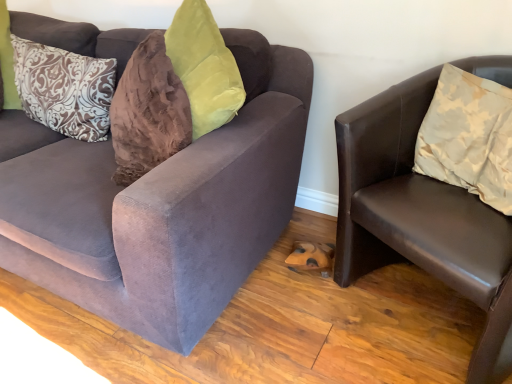
Locate an element on the screen. This screenshot has width=512, height=384. velvet brown couch at left, arranged as the 1th studio couch when viewed from the left is located at coordinates (160, 206).

In order to face velvet brown couch at left, arranged as the 1th studio couch when viewed from the left, should I rotate leftwards or rightwards?

To align with it, rotate left about 25.259°.

The height and width of the screenshot is (384, 512). Find the location of `brown patterned pillow at left, which appears as the first pillow when viewed from the back`. brown patterned pillow at left, which appears as the first pillow when viewed from the back is located at coordinates (64, 89).

From the image's perspective, does brown patterned pillow at left, which appears as the first pillow when viewed from the back, appear higher than velvet brown couch at left, arranged as the 1th studio couch when viewed from the left?

Yes, from the image's perspective, brown patterned pillow at left, which appears as the first pillow when viewed from the back, is above velvet brown couch at left, arranged as the 1th studio couch when viewed from the left.

Is brown patterned pillow at left, which appears as the first pillow when viewed from the back, not close to velvet brown couch at left, the 2th studio couch viewed from the right?

No, brown patterned pillow at left, which appears as the first pillow when viewed from the back, is not far from velvet brown couch at left, the 2th studio couch viewed from the right.

In the image, is brown patterned pillow at left, the 2th pillow viewed from the right, positioned in front of or behind velvet brown couch at left, arranged as the 1th studio couch when viewed from the left?

In the image, brown patterned pillow at left, the 2th pillow viewed from the right, appears behind velvet brown couch at left, arranged as the 1th studio couch when viewed from the left.

Between brown patterned pillow at left, which ranks as the first pillow in left-to-right order, and velvet brown couch at left, the 2th studio couch viewed from the right, which one has more height?

velvet brown couch at left, the 2th studio couch viewed from the right.

Measure the distance between beige satin pillow at right, marked as the second pillow in a left-to-right arrangement, and velvet brown couch at left, the 2th studio couch viewed from the right.

beige satin pillow at right, marked as the second pillow in a left-to-right arrangement, is 28.69 inches from velvet brown couch at left, the 2th studio couch viewed from the right.

Who is shorter, beige satin pillow at right, the 2th pillow when ordered from back to front, or velvet brown couch at left, arranged as the 1th studio couch when viewed from the left?

With less height is beige satin pillow at right, the 2th pillow when ordered from back to front.

I want to click on the 1st pillow behind the velvet brown couch at left, arranged as the 1th studio couch when viewed from the left, so click(469, 137).

Based on their sizes in the image, would you say beige satin pillow at right, marked as the second pillow in a left-to-right arrangement, is bigger or smaller than velvet brown couch at left, arranged as the 1th studio couch when viewed from the left?

beige satin pillow at right, marked as the second pillow in a left-to-right arrangement, is smaller than velvet brown couch at left, arranged as the 1th studio couch when viewed from the left.

Considering the sizes of brown leather chair at right, which is the second studio couch from left to right, and velvet brown couch at left, arranged as the 1th studio couch when viewed from the left, in the image, is brown leather chair at right, which is the second studio couch from left to right, taller or shorter than velvet brown couch at left, arranged as the 1th studio couch when viewed from the left,?

Considering their sizes, brown leather chair at right, which is the second studio couch from left to right, has less height than velvet brown couch at left, arranged as the 1th studio couch when viewed from the left.

From a real-world perspective, is brown leather chair at right, which is the second studio couch from left to right, positioned over velvet brown couch at left, the 2th studio couch viewed from the right, based on gravity?

Incorrect, from a real-world perspective, brown leather chair at right, which is the second studio couch from left to right, is lower than velvet brown couch at left, the 2th studio couch viewed from the right.

Considering the relative positions of brown leather chair at right, the first studio couch viewed from the right, and velvet brown couch at left, arranged as the 1th studio couch when viewed from the left, in the image provided, is brown leather chair at right, the first studio couch viewed from the right, to the left of velvet brown couch at left, arranged as the 1th studio couch when viewed from the left, from the viewer's perspective?

No.

Where is `studio couch that appears behind the brown leather chair at right, the first studio couch viewed from the right`? This screenshot has height=384, width=512. studio couch that appears behind the brown leather chair at right, the first studio couch viewed from the right is located at coordinates (160, 206).

Between brown patterned pillow at left, which ranks as the 2th pillow in front-to-back order, and beige satin pillow at right, the first pillow when ordered from right to left, which one has smaller width?

brown patterned pillow at left, which ranks as the 2th pillow in front-to-back order.

Can you confirm if brown patterned pillow at left, which ranks as the first pillow in left-to-right order, is shorter than beige satin pillow at right, marked as the second pillow in a left-to-right arrangement?

In fact, brown patterned pillow at left, which ranks as the first pillow in left-to-right order, may be taller than beige satin pillow at right, marked as the second pillow in a left-to-right arrangement.

From a real-world perspective, is brown patterned pillow at left, which ranks as the 2th pillow in front-to-back order, above or below beige satin pillow at right, marked as the second pillow in a left-to-right arrangement?

From a real-world perspective, brown patterned pillow at left, which ranks as the 2th pillow in front-to-back order, is physically below beige satin pillow at right, marked as the second pillow in a left-to-right arrangement.

Is beige satin pillow at right, marked as the second pillow in a left-to-right arrangement, surrounded by brown patterned pillow at left, which ranks as the 2th pillow in front-to-back order?

No, beige satin pillow at right, marked as the second pillow in a left-to-right arrangement, is located outside of brown patterned pillow at left, which ranks as the 2th pillow in front-to-back order.

Is velvet brown couch at left, arranged as the 1th studio couch when viewed from the left, oriented towards brown patterned pillow at left, which ranks as the first pillow in left-to-right order?

Yes, velvet brown couch at left, arranged as the 1th studio couch when viewed from the left, is turned towards brown patterned pillow at left, which ranks as the first pillow in left-to-right order.

Is velvet brown couch at left, arranged as the 1th studio couch when viewed from the left, thinner than brown patterned pillow at left, the 2th pillow viewed from the right?

In fact, velvet brown couch at left, arranged as the 1th studio couch when viewed from the left, might be wider than brown patterned pillow at left, the 2th pillow viewed from the right.

From a real-world perspective, between velvet brown couch at left, the 2th studio couch viewed from the right, and brown patterned pillow at left, which ranks as the first pillow in left-to-right order, who is vertically higher?

brown patterned pillow at left, which ranks as the first pillow in left-to-right order, is physically above.

Considering the relative positions of velvet brown couch at left, the 2th studio couch viewed from the right, and brown patterned pillow at left, which ranks as the first pillow in left-to-right order, in the image provided, is velvet brown couch at left, the 2th studio couch viewed from the right, to the right of brown patterned pillow at left, which ranks as the first pillow in left-to-right order, from the viewer's perspective?

Incorrect, velvet brown couch at left, the 2th studio couch viewed from the right, is not on the right side of brown patterned pillow at left, which ranks as the first pillow in left-to-right order.

Does beige satin pillow at right, the first pillow when ordered from right to left, have a lesser height compared to brown patterned pillow at left, which ranks as the 2th pillow in front-to-back order?

Yes, beige satin pillow at right, the first pillow when ordered from right to left, is shorter than brown patterned pillow at left, which ranks as the 2th pillow in front-to-back order.

Is beige satin pillow at right, marked as the second pillow in a left-to-right arrangement, in front of or behind brown patterned pillow at left, the 2th pillow viewed from the right, in the image?

In the image, beige satin pillow at right, marked as the second pillow in a left-to-right arrangement, appears in front of brown patterned pillow at left, the 2th pillow viewed from the right.

Is point (104, 71) positioned before point (407, 88)?

No, it is behind (407, 88).

Is brown patterned pillow at left, which ranks as the first pillow in left-to-right order, facing towards brown leather chair at right, the first studio couch viewed from the right?

No, brown patterned pillow at left, which ranks as the first pillow in left-to-right order, is not facing towards brown leather chair at right, the first studio couch viewed from the right.

Considering the relative sizes of brown patterned pillow at left, which ranks as the first pillow in left-to-right order, and brown leather chair at right, the first studio couch viewed from the right, in the image provided, is brown patterned pillow at left, which ranks as the first pillow in left-to-right order, smaller than brown leather chair at right, the first studio couch viewed from the right,?

Correct, brown patterned pillow at left, which ranks as the first pillow in left-to-right order, occupies less space than brown leather chair at right, the first studio couch viewed from the right.

From the image's perspective, is brown patterned pillow at left, which ranks as the 2th pillow in front-to-back order, above or below brown leather chair at right, which is the second studio couch from left to right?

Based on their image positions, brown patterned pillow at left, which ranks as the 2th pillow in front-to-back order, is located above brown leather chair at right, which is the second studio couch from left to right.

I want to click on the 1st studio couch in front of the brown patterned pillow at left, which ranks as the 2th pillow in front-to-back order, counting from the anchor's position, so click(160, 206).

You are a GUI agent. You are given a task and a screenshot of the screen. Output one action in this format:
    pyautogui.click(x=<x>, y=<y>)
    Task: Click on the 1st pillow behind the velvet brown couch at left, the 2th studio couch viewed from the right
    
    Given the screenshot: What is the action you would take?
    pyautogui.click(x=469, y=137)

When comparing their distances from velvet brown couch at left, arranged as the 1th studio couch when viewed from the left, does brown patterned pillow at left, which ranks as the 2th pillow in front-to-back order, or beige satin pillow at right, marked as the second pillow in a left-to-right arrangement, seem closer?

brown patterned pillow at left, which ranks as the 2th pillow in front-to-back order, is closer to velvet brown couch at left, arranged as the 1th studio couch when viewed from the left.

Based on their spatial positions, is beige satin pillow at right, marked as the second pillow in a left-to-right arrangement, or velvet brown couch at left, the 2th studio couch viewed from the right, closer to brown patterned pillow at left, the 2th pillow viewed from the right?

velvet brown couch at left, the 2th studio couch viewed from the right.

Based on their spatial positions, is brown leather chair at right, the first studio couch viewed from the right, or beige satin pillow at right, marked as the second pillow in a left-to-right arrangement, further from velvet brown couch at left, arranged as the 1th studio couch when viewed from the left?

beige satin pillow at right, marked as the second pillow in a left-to-right arrangement.

From the image, which object appears to be nearer to beige satin pillow at right, marked as the second pillow in a left-to-right arrangement, brown leather chair at right, the first studio couch viewed from the right, or velvet brown couch at left, the 2th studio couch viewed from the right?

brown leather chair at right, the first studio couch viewed from the right, lies closer to beige satin pillow at right, marked as the second pillow in a left-to-right arrangement, than the other object.

Based on their spatial positions, is velvet brown couch at left, the 2th studio couch viewed from the right, or beige satin pillow at right, the 1th pillow from the front, closer to brown leather chair at right, which is the second studio couch from left to right?

beige satin pillow at right, the 1th pillow from the front, is closer to brown leather chair at right, which is the second studio couch from left to right.

Looking at the image, which one is located closer to brown patterned pillow at left, which ranks as the first pillow in left-to-right order, velvet brown couch at left, arranged as the 1th studio couch when viewed from the left, or brown leather chair at right, the first studio couch viewed from the right?

The object closer to brown patterned pillow at left, which ranks as the first pillow in left-to-right order, is velvet brown couch at left, arranged as the 1th studio couch when viewed from the left.

When comparing their distances from beige satin pillow at right, the 1th pillow from the front, does velvet brown couch at left, arranged as the 1th studio couch when viewed from the left, or brown patterned pillow at left, which appears as the first pillow when viewed from the back, seem closer?

Among the two, velvet brown couch at left, arranged as the 1th studio couch when viewed from the left, is located nearer to beige satin pillow at right, the 1th pillow from the front.

Which object lies further to the anchor point brown patterned pillow at left, which ranks as the first pillow in left-to-right order, velvet brown couch at left, the 2th studio couch viewed from the right, or beige satin pillow at right, the first pillow when ordered from right to left?

Based on the image, beige satin pillow at right, the first pillow when ordered from right to left, appears to be further to brown patterned pillow at left, which ranks as the first pillow in left-to-right order.

Where is `pillow between velvet brown couch at left, arranged as the 1th studio couch when viewed from the left, and brown leather chair at right, the first studio couch viewed from the right, in the horizontal direction`? This screenshot has height=384, width=512. pillow between velvet brown couch at left, arranged as the 1th studio couch when viewed from the left, and brown leather chair at right, the first studio couch viewed from the right, in the horizontal direction is located at coordinates click(64, 89).

This screenshot has height=384, width=512. I want to click on pillow located between velvet brown couch at left, arranged as the 1th studio couch when viewed from the left, and beige satin pillow at right, the 2th pillow when ordered from back to front, in the left-right direction, so click(64, 89).

You are a GUI agent. You are given a task and a screenshot of the screen. Output one action in this format:
    pyautogui.click(x=<x>, y=<y>)
    Task: Click on the studio couch between velvet brown couch at left, the 2th studio couch viewed from the right, and beige satin pillow at right, the 2th pillow when ordered from back to front, from left to right
    
    Given the screenshot: What is the action you would take?
    pyautogui.click(x=420, y=217)

I want to click on studio couch between brown patterned pillow at left, the 2th pillow viewed from the right, and beige satin pillow at right, the 2th pillow when ordered from back to front, in the horizontal direction, so click(420, 217).